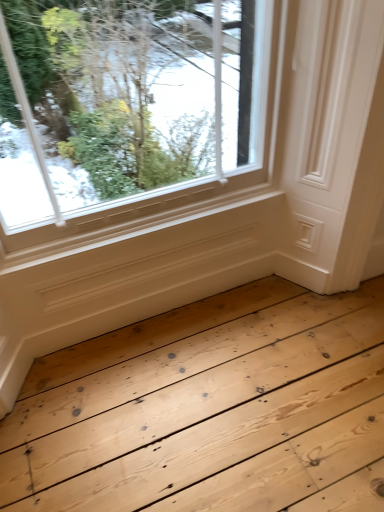
What do you see at coordinates (133, 115) in the screenshot? The height and width of the screenshot is (512, 384). I see `clear glass window at upper left` at bounding box center [133, 115].

Locate an element on the screen. The height and width of the screenshot is (512, 384). clear glass window at upper left is located at coordinates (133, 115).

The height and width of the screenshot is (512, 384). I want to click on clear glass window at upper left, so click(x=133, y=115).